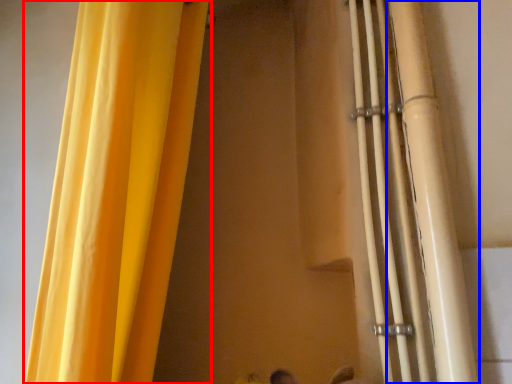
Question: Which object appears farthest to the camera in this image, curtain (highlighted by a red box) or pipe (highlighted by a blue box)?

Choices:
 (A) curtain
 (B) pipe

Answer: (B)